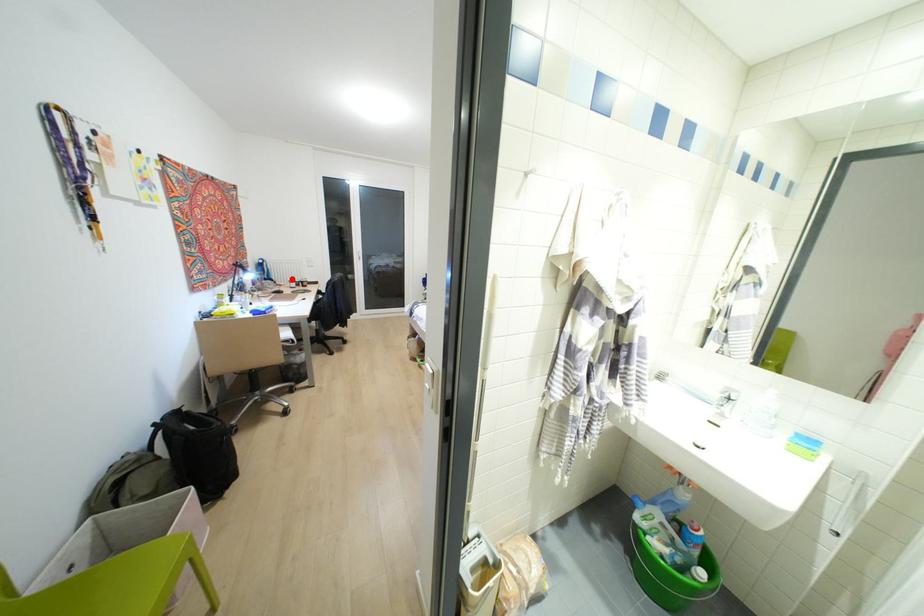
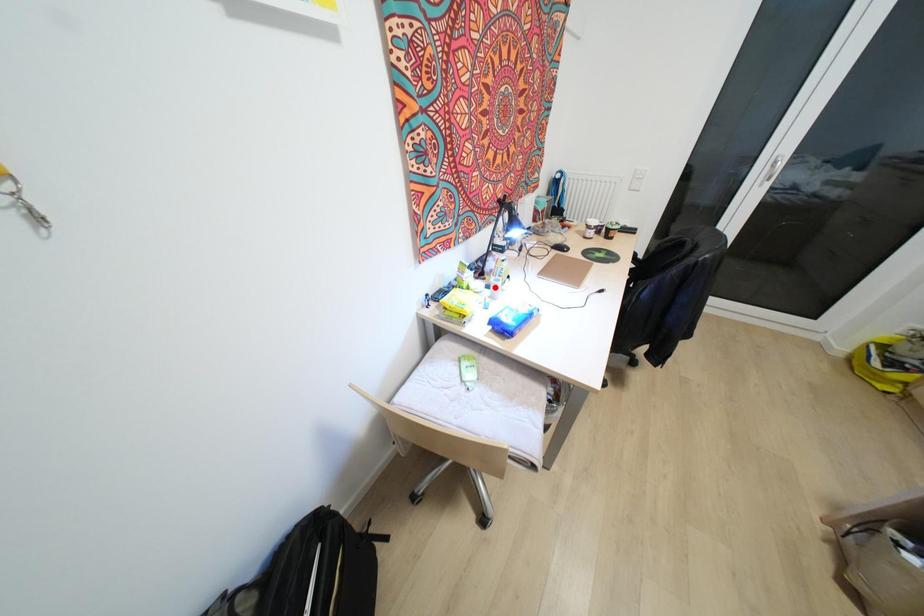
I am providing you with two images of the same scene from different viewpoints. A red point is marked on the first image and another point is marked on the second image. Do the highlighted points in image1 and image2 indicate the same real-world spot?

No